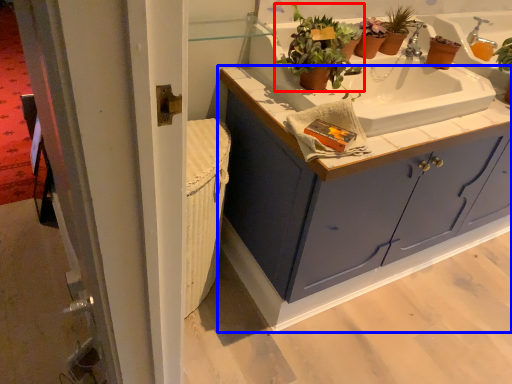
Question: Among these objects, which one is nearest to the camera, houseplant (highlighted by a red box) or bathroom cabinet (highlighted by a blue box)?

Choices:
 (A) houseplant
 (B) bathroom cabinet

Answer: (B)